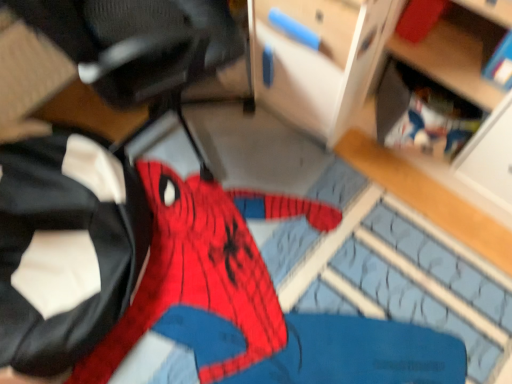
Question: Is red fabric spider-man costume at left outside of wooden bookshelf at upper right, which is counted as the second shelf, starting from the front?

Choices:
 (A) yes
 (B) no

Answer: (A)

Question: From the image's perspective, is red fabric spider-man costume at left under wooden bookshelf at upper right, arranged as the first shelf when viewed from the back?

Choices:
 (A) yes
 (B) no

Answer: (A)

Question: Considering the relative sizes of red fabric spider-man costume at left and wooden bookshelf at upper right, arranged as the first shelf when viewed from the back, in the image provided, is red fabric spider-man costume at left wider than wooden bookshelf at upper right, arranged as the first shelf when viewed from the back,?

Choices:
 (A) no
 (B) yes

Answer: (B)

Question: Is wooden bookshelf at upper right, arranged as the first shelf when viewed from the back, inside red fabric spider-man costume at left?

Choices:
 (A) yes
 (B) no

Answer: (B)

Question: Does red fabric spider-man costume at left have a smaller size compared to wooden bookshelf at upper right, arranged as the first shelf when viewed from the back?

Choices:
 (A) no
 (B) yes

Answer: (A)

Question: Is red fabric spider-man costume at left to the left or to the right of wooden bookshelf at upper right, arranged as the first shelf when viewed from the back, in the image?

Choices:
 (A) left
 (B) right

Answer: (A)

Question: From a real-world perspective, relative to wooden bookshelf at upper right, which is counted as the second shelf, starting from the front, is red fabric spider-man costume at left vertically above or below?

Choices:
 (A) below
 (B) above

Answer: (A)

Question: Is point (37, 185) positioned closer to the camera than point (403, 86)?

Choices:
 (A) farther
 (B) closer

Answer: (A)

Question: In terms of height, does red fabric spider-man costume at left look taller or shorter compared to wooden bookshelf at upper right, arranged as the first shelf when viewed from the back?

Choices:
 (A) tall
 (B) short

Answer: (A)

Question: Does point (509, 140) appear closer or farther from the camera than point (408, 104)?

Choices:
 (A) closer
 (B) farther

Answer: (A)

Question: Considering their positions, is wooden shelf at lower right, which is the second shelf from back to front, located in front of or behind wooden bookshelf at upper right, arranged as the first shelf when viewed from the back?

Choices:
 (A) behind
 (B) front

Answer: (B)

Question: From the image's perspective, relative to wooden bookshelf at upper right, which is counted as the second shelf, starting from the front, is wooden shelf at lower right, which is the second shelf from back to front, above or below?

Choices:
 (A) below
 (B) above

Answer: (B)

Question: Considering the positions of wooden shelf at lower right, which is the second shelf from back to front, and wooden bookshelf at upper right, arranged as the first shelf when viewed from the back, in the image, is wooden shelf at lower right, which is the second shelf from back to front, taller or shorter than wooden bookshelf at upper right, arranged as the first shelf when viewed from the back,?

Choices:
 (A) short
 (B) tall

Answer: (B)

Question: In terms of width, does wooden shelf at lower right, which ranks as the 1th shelf in front-to-back order, look wider or thinner when compared to red fabric spider-man costume at left?

Choices:
 (A) wide
 (B) thin

Answer: (B)

Question: Is wooden shelf at lower right, which ranks as the 1th shelf in front-to-back order, bigger or smaller than red fabric spider-man costume at left?

Choices:
 (A) big
 (B) small

Answer: (A)